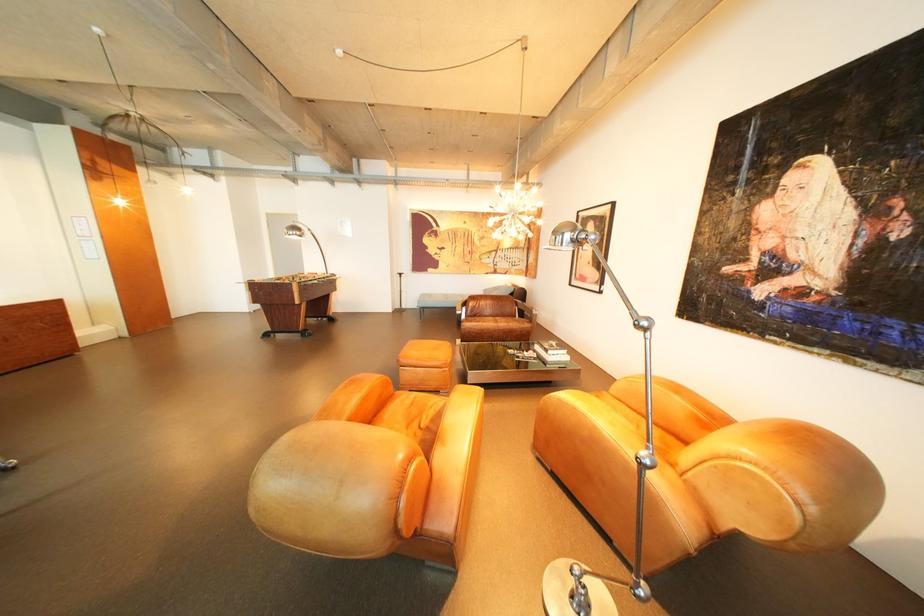
At what (x,y) coordinates should I click in order to perform the action: click on blue sitting bench. Please return your answer as a coordinate pair (x, y). Looking at the image, I should click on (442, 296).